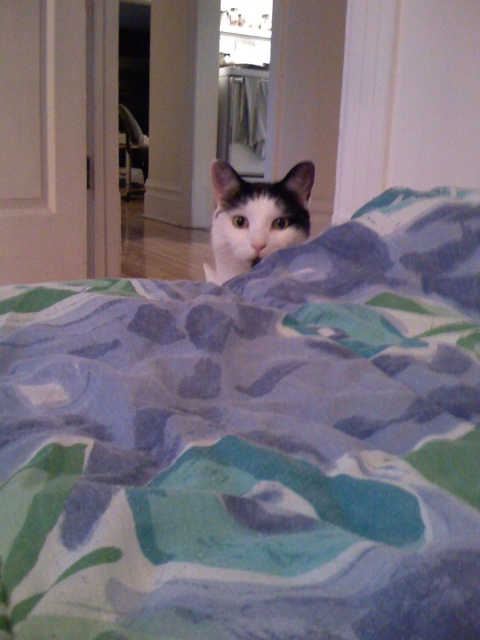
Is printed fabric blanket at center to the left of white fur cat at center from the viewer's perspective?

No, printed fabric blanket at center is not to the left of white fur cat at center.

Describe the element at coordinates (252, 442) in the screenshot. I see `printed fabric blanket at center` at that location.

At what (x,y) coordinates should I click in order to perform the action: click on printed fabric blanket at center. Please return your answer as a coordinate pair (x, y). This screenshot has height=640, width=480. Looking at the image, I should click on (252, 442).